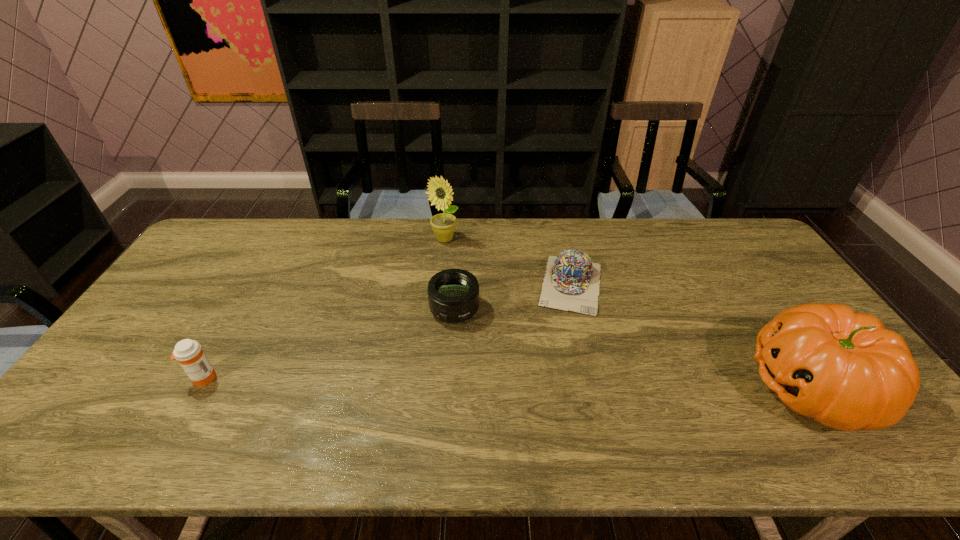
Where is `free space at the right edge of the desktop`? This screenshot has width=960, height=540. free space at the right edge of the desktop is located at coordinates (750, 270).

Identify the location of blank space at the far left corner of the desktop. The width and height of the screenshot is (960, 540). (205, 239).

Locate an element on the screen. vacant area at the near left corner of the desktop is located at coordinates (82, 404).

This screenshot has width=960, height=540. What are the coordinates of `free spot at the far right corner of the desktop` in the screenshot? It's located at (717, 232).

The width and height of the screenshot is (960, 540). Find the location of `vacant area between the cap and the farthest object`. vacant area between the cap and the farthest object is located at coordinates (508, 262).

What are the coordinates of `vacant area that lies between the medicine and the shortest object` in the screenshot? It's located at (387, 331).

Locate an element on the screen. This screenshot has width=960, height=540. free space that is in between the leftmost object and the second tallest object is located at coordinates (509, 382).

The image size is (960, 540). Find the location of `free space between the cap and the telephoto lens`. free space between the cap and the telephoto lens is located at coordinates (513, 297).

You are a GUI agent. You are given a task and a screenshot of the screen. Output one action in this format:
    pyautogui.click(x=<x>, y=<y>)
    Task: Click on the free spot between the second tallest object and the telephoto lens
    The image size is (960, 540).
    Given the screenshot: What is the action you would take?
    pyautogui.click(x=634, y=348)

Where is `free area in between the second tallest object and the fourth object from left to right`? The height and width of the screenshot is (540, 960). free area in between the second tallest object and the fourth object from left to right is located at coordinates (692, 335).